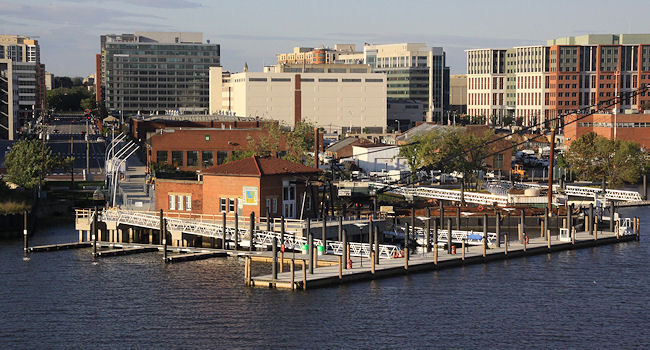
Where is `window`? window is located at coordinates (224, 203), (229, 202).